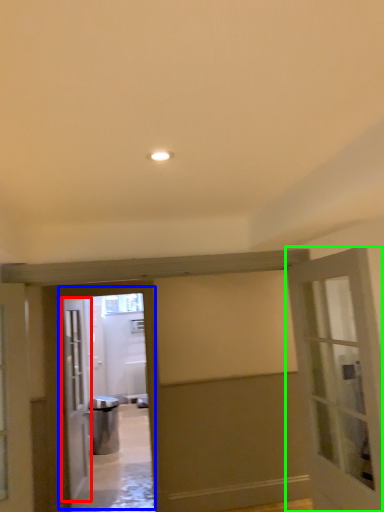
Question: Which object is positioned closest to door (highlighted by a red box)? Select from elevator (highlighted by a blue box) and door (highlighted by a green box).

Choices:
 (A) elevator
 (B) door

Answer: (A)